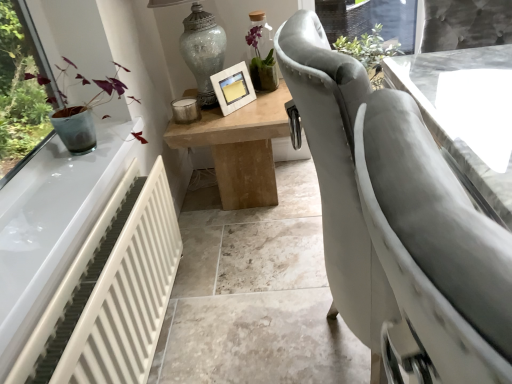
Find the location of a particular element. The image size is (512, 384). vacant area that is in front of white textured picture frame at center is located at coordinates (237, 121).